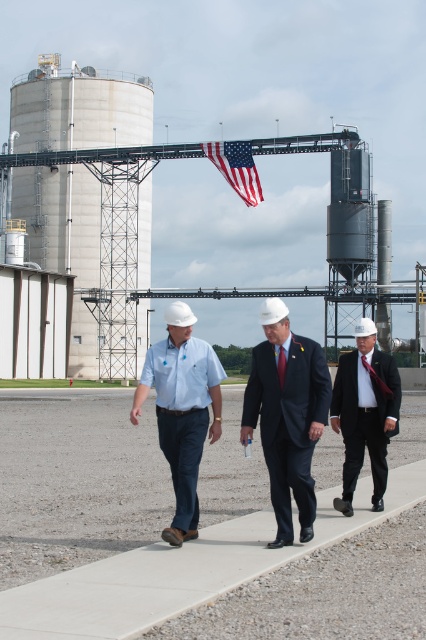
Which is behind, point (336, 472) or point (241, 177)?

Point (241, 177)

Which of these two, concrete at center or american flag at center, stands shorter?

With less height is concrete at center.

The image size is (426, 640). What are the coordinates of `concrete at center` in the screenshot? It's located at (77, 483).

Where is `dark blue suit at center`? dark blue suit at center is located at coordinates (287, 417).

Between point (296, 372) and point (236, 154), which one is positioned in front?

Point (296, 372) is more forward.

Who is more distant from viewer, [294,356] or [221,163]?

The point [221,163] is more distant.

Find the location of a particular element. dark blue suit at center is located at coordinates (287, 417).

Can you confirm if gray concrete silo at upper left is wider than matte blue shirt at center?

Yes.

Which of these two, gray concrete silo at upper left or matte blue shirt at center, stands shorter?

With less height is matte blue shirt at center.

Does point (81, 129) lie behind point (152, 380)?

That is True.

This screenshot has width=426, height=640. I want to click on gray concrete silo at upper left, so (x=78, y=108).